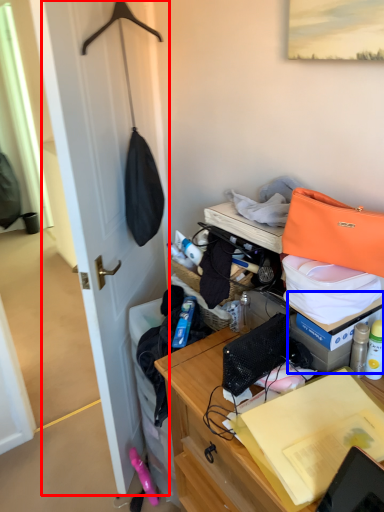
Question: Which object is further to the camera taking this photo, door (highlighted by a red box) or box (highlighted by a blue box)?

Choices:
 (A) door
 (B) box

Answer: (B)